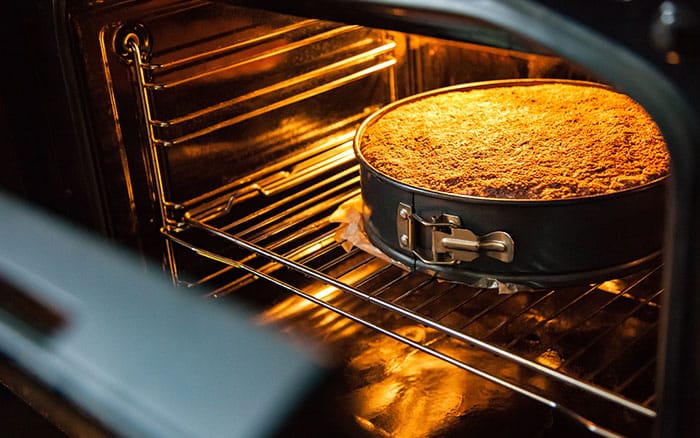
Where is `edge of oven door`? This screenshot has height=438, width=700. edge of oven door is located at coordinates (244, 377).